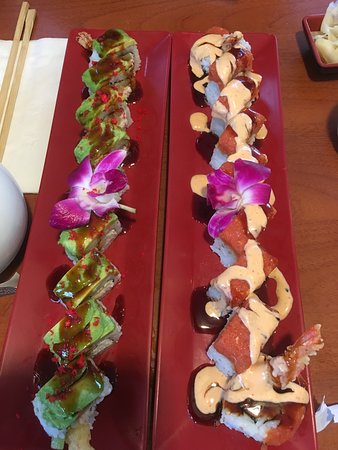
The height and width of the screenshot is (450, 338). What are the coordinates of `napkin` in the screenshot? It's located at (31, 104).